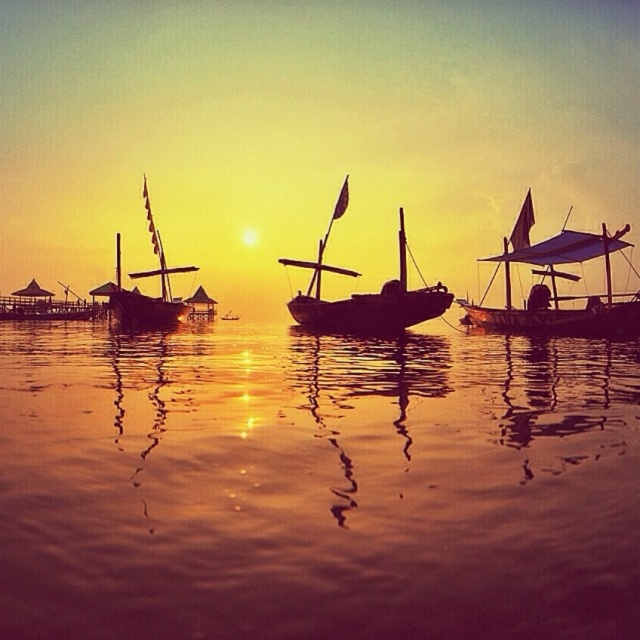
Question: Which point appears farthest from the camera in this image?

Choices:
 (A) (228, 312)
 (B) (532, 332)
 (C) (161, 317)

Answer: (A)

Question: Based on their relative distances, which object is farther from the wooden sailboat at right?

Choices:
 (A) brushed metal boat at center
 (B) wooden sailboat at left

Answer: (A)

Question: Which of these objects is positioned closest to the wooden boat at left?

Choices:
 (A) shiny golden water at center
 (B) wooden sailboat at center
 (C) wooden sailboat at right

Answer: (B)

Question: Is wooden sailboat at left to the left of brushed metal boat at center from the viewer's perspective?

Choices:
 (A) no
 (B) yes

Answer: (B)

Question: Does shiny golden water at center have a larger size compared to brushed metal boat at center?

Choices:
 (A) yes
 (B) no

Answer: (A)

Question: Is wooden sailboat at left bigger than wooden boat at left?

Choices:
 (A) yes
 (B) no

Answer: (A)